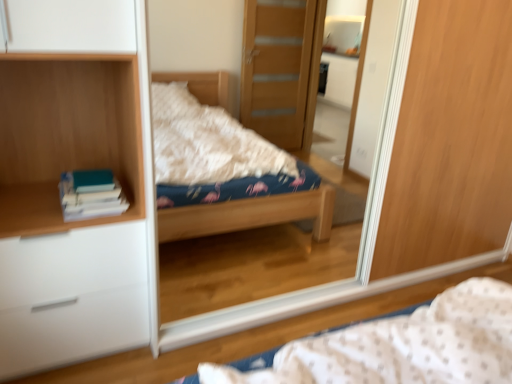
Question: Is white matte chest of drawers at left to the right of wooden bookshelf at left from the viewer's perspective?

Choices:
 (A) yes
 (B) no

Answer: (B)

Question: Is the depth of white matte chest of drawers at left less than that of wooden bookshelf at left?

Choices:
 (A) yes
 (B) no

Answer: (B)

Question: Does white matte chest of drawers at left appear on the left side of wooden bookshelf at left?

Choices:
 (A) no
 (B) yes

Answer: (B)

Question: Could you tell me if white matte chest of drawers at left is turned towards wooden bookshelf at left?

Choices:
 (A) yes
 (B) no

Answer: (B)

Question: Are white matte chest of drawers at left and wooden bookshelf at left located far from each other?

Choices:
 (A) yes
 (B) no

Answer: (B)

Question: Is white matte chest of drawers at left next to wooden bookshelf at left?

Choices:
 (A) no
 (B) yes

Answer: (A)

Question: Is teal matte book at left not close to fluffy fabric bed at center?

Choices:
 (A) yes
 (B) no

Answer: (A)

Question: From the image's perspective, would you say teal matte book at left is shown under fluffy fabric bed at center?

Choices:
 (A) yes
 (B) no

Answer: (B)

Question: Is teal matte book at left facing towards fluffy fabric bed at center?

Choices:
 (A) yes
 (B) no

Answer: (B)

Question: Does teal matte book at left come behind fluffy fabric bed at center?

Choices:
 (A) no
 (B) yes

Answer: (B)

Question: Considering the relative sizes of teal matte book at left and fluffy fabric bed at center in the image provided, is teal matte book at left thinner than fluffy fabric bed at center?

Choices:
 (A) no
 (B) yes

Answer: (B)

Question: Would you say teal matte book at left is outside fluffy fabric bed at center?

Choices:
 (A) yes
 (B) no

Answer: (A)

Question: Would you say wooden bookshelf at left is outside teal matte book at left?

Choices:
 (A) no
 (B) yes

Answer: (B)